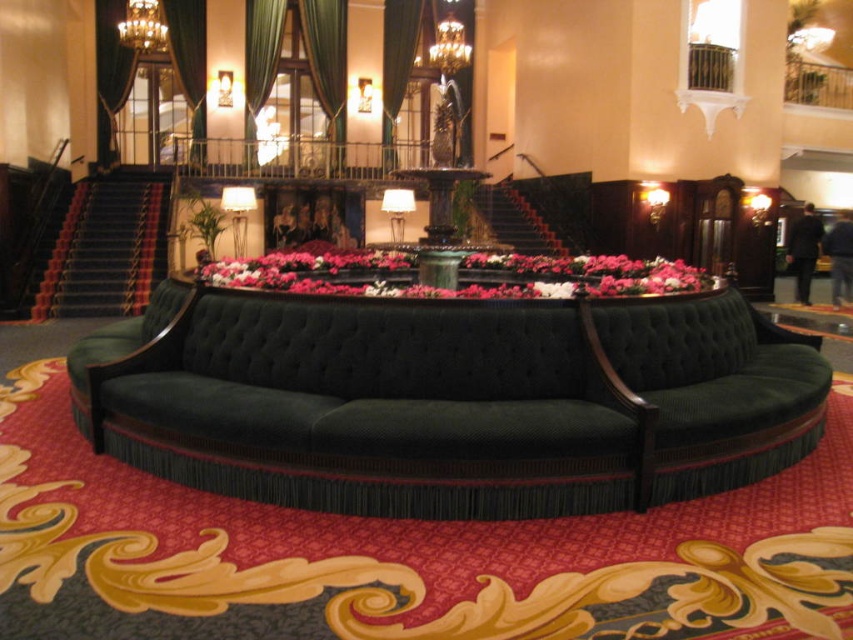
You are standing in the grand opulent building and want to find the exact location of the point marked at coordinates (450, 400). Based on the scene description, can you determine which object this point is located on?

The point marked at coordinates (450, 400) is located on the velvet green couch at center.